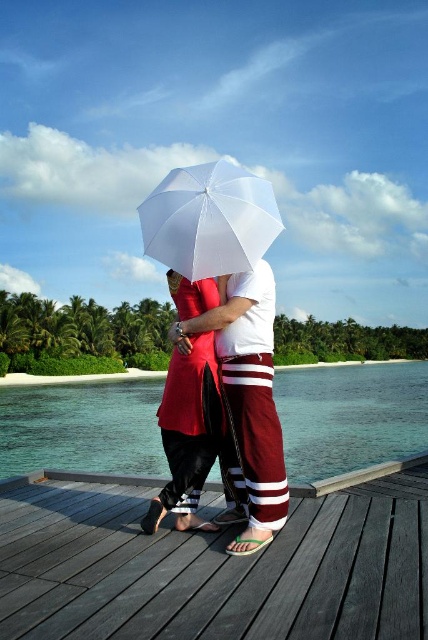
You are a photographer trying to capture the clear blue water at center in your shot. The camera you are using has a focal point grid divided into 9 equal squares. To ensure the water is the main focus, where should you place the focal point on the grid? Remember, the grid coordinates are from 0 to 1 in both horizontal and vertical directions.

The clear blue water at center is located at coordinates point (350, 417). To focus on it, place the focal point at the grid square corresponding to these coordinates, which would be near the lower middle section of the grid.

You are a photographer trying to capture a photo of the matte red dress at center without the white matte umbrella at center blocking it. Is this possible based on their positions?

The white matte umbrella at center is in front of the matte red dress at center, so it would block the view. To capture the dress without the umbrella blocking it, you would need to adjust the angle or move the umbrella.